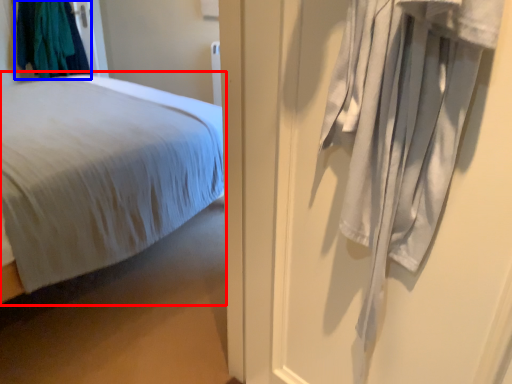
Question: Which of the following is the closest to the observer, bed (highlighted by a red box) or clothing (highlighted by a blue box)?

Choices:
 (A) bed
 (B) clothing

Answer: (A)